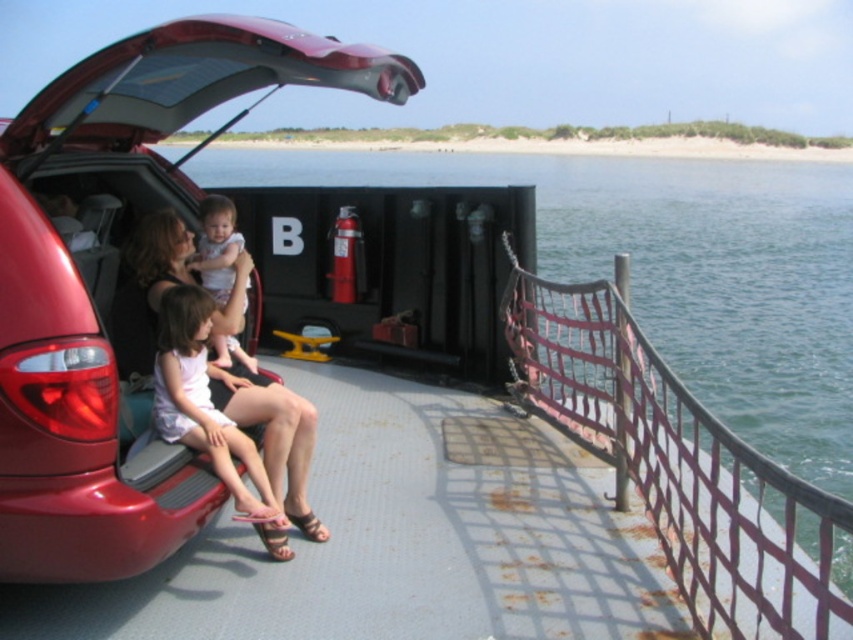
You are standing on the ferry and see the clear water at center and the matte black shorts at lower left. Which object is higher in the scene?

The clear water at center is above the matte black shorts at lower left, so it is higher in the scene.

You are standing on the ferry and want to walk from the clear water at center to the matte black shorts at lower left. Which direction should you move in?

To move from the clear water at center to the matte black shorts at lower left, you should move backward since the clear water at center is in front of matte black shorts at lower left.

You are a delivery person trying to park your truck next to the shiny red car at center and the rusty metal rail at right. Since your truck is 2 meters wide, can you park it between them without overlapping?

The shiny red car at center has a lesser width compared to rusty metal rail at right. The width of the shiny red car at center is not provided, so it is impossible to determine if the truck can fit between them without overlapping.